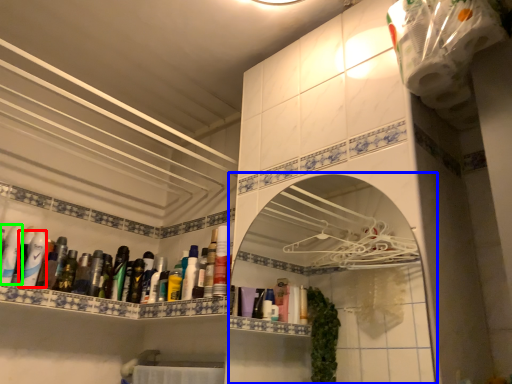
Question: Based on their relative distances, which object is farther from mouthwash (highlighted by a red box)? Choose from medicine cabinet (highlighted by a blue box) and mouthwash (highlighted by a green box).

Choices:
 (A) medicine cabinet
 (B) mouthwash

Answer: (A)